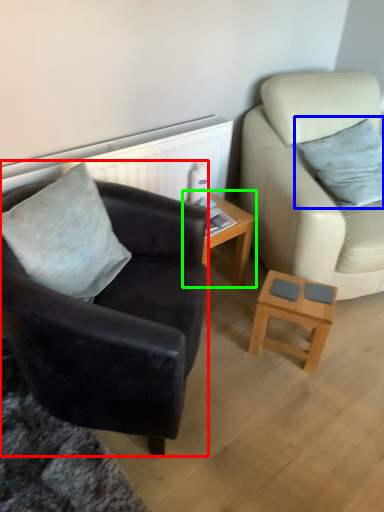
Question: Considering the real-world distances, which object is farthest from chair (highlighted by a red box)? pillow (highlighted by a blue box) or table (highlighted by a green box)?

Choices:
 (A) pillow
 (B) table

Answer: (A)